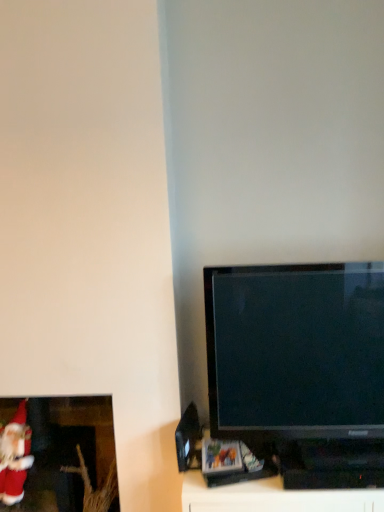
Question: Visually, is matte red santa at lower left positioned to the left or to the right of black glossy tv at right?

Choices:
 (A) left
 (B) right

Answer: (A)

Question: From the image's perspective, is matte red santa at lower left located above or below black glossy tv at right?

Choices:
 (A) below
 (B) above

Answer: (A)

Question: Which object is positioned closest to the matte red santa at lower left?

Choices:
 (A) black glossy tv at right
 (B) velvet red santa claus at lower left

Answer: (B)

Question: Considering the real-world distances, which object is farthest from the velvet red santa claus at lower left?

Choices:
 (A) matte red santa at lower left
 (B) black glossy tv at right

Answer: (B)